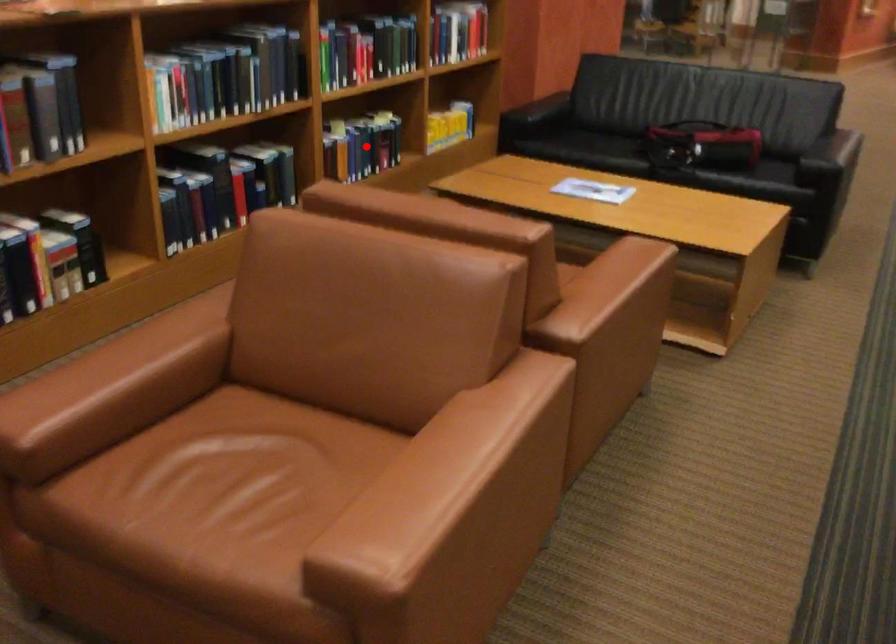
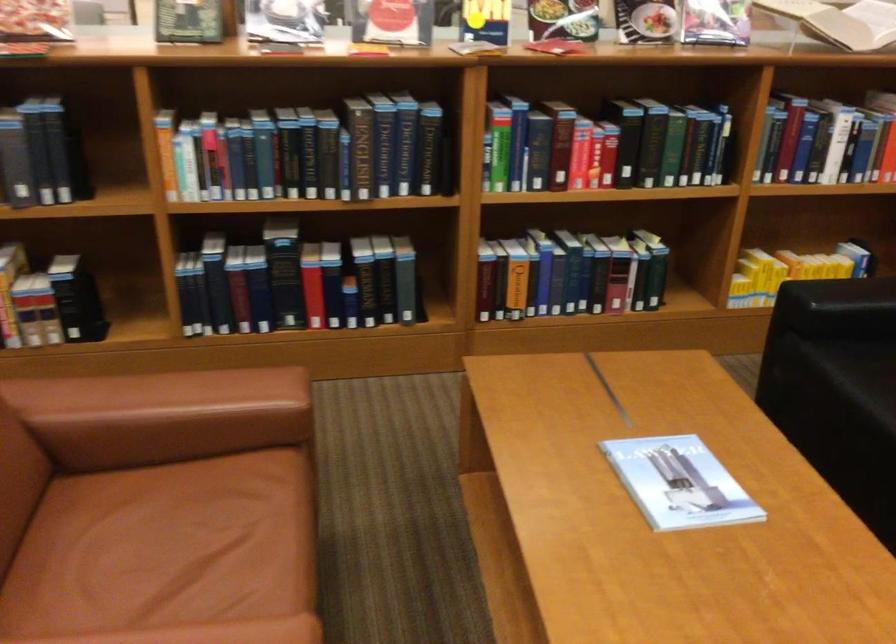
The point at the highlighted location is marked in the first image. Where is the corresponding point in the second image?

(569, 275)